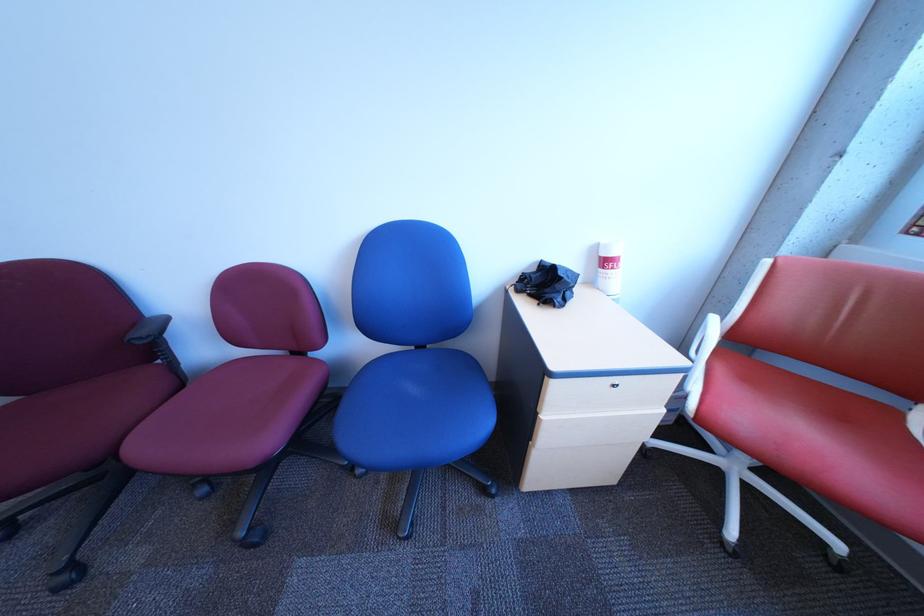
What do you see at coordinates (876, 402) in the screenshot? I see `a red chair sitting surface` at bounding box center [876, 402].